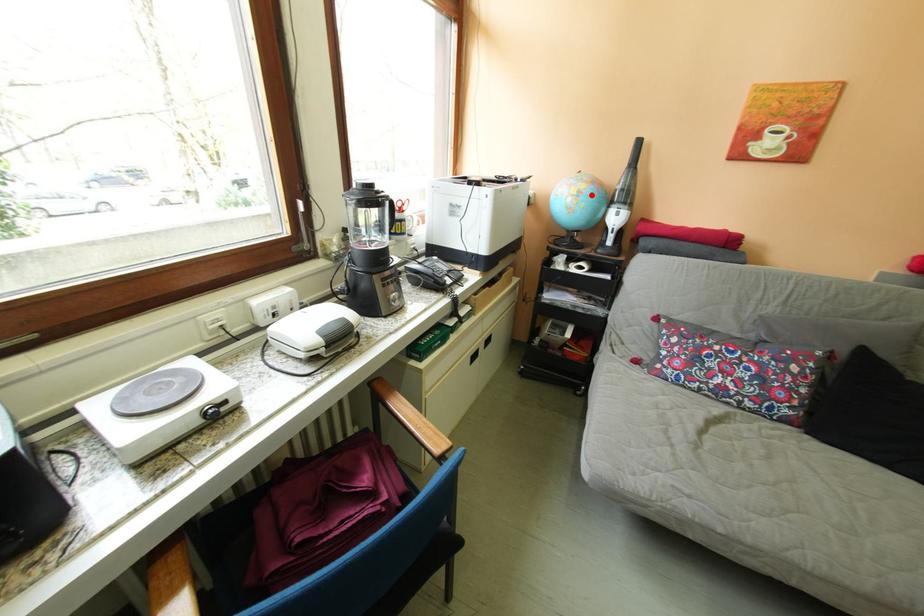
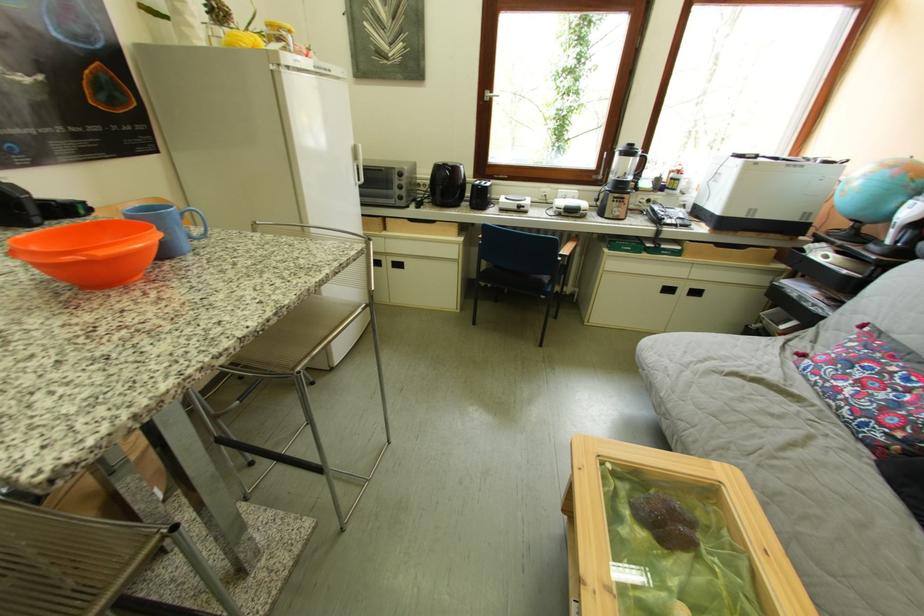
Locate, in the second image, the point that corresponds to the highlighted location in the first image.

(877, 177)